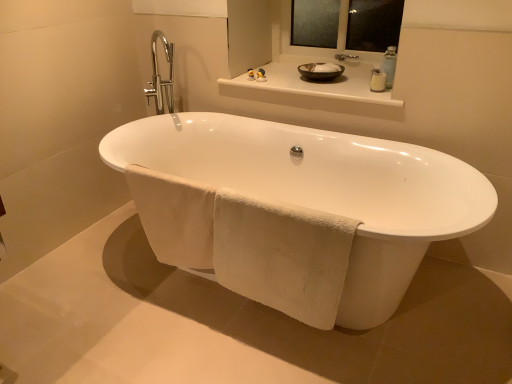
Question: Is matte rubber duck at upper center spatially inside white glossy counter top at upper center, or outside of it?

Choices:
 (A) inside
 (B) outside

Answer: (B)

Question: Considering their positions, is matte rubber duck at upper center located in front of or behind white glossy counter top at upper center?

Choices:
 (A) behind
 (B) front

Answer: (A)

Question: Considering the real-world distances, which object is closest to the white glossy counter top at upper center?

Choices:
 (A) matte rubber duck at upper center
 (B) white ceramic bathtub at center
 (C) transparent glass mirror at upper center
 (D) white soft towel at lower center, which appears as the second bath towel when viewed from the right
 (E) white cotton towel at lower center, positioned as the 2th bath towel in left-to-right order

Answer: (C)

Question: Which object is positioned farthest from the matte brown bowl at upper center?

Choices:
 (A) clear plastic soap dispenser at upper right
 (B) white soft towel at lower center, the 1th bath towel from the left
 (C) white ceramic bathtub at center
 (D) white glossy counter top at upper center
 (E) white cotton towel at lower center, the 1th bath towel when ordered from right to left

Answer: (E)